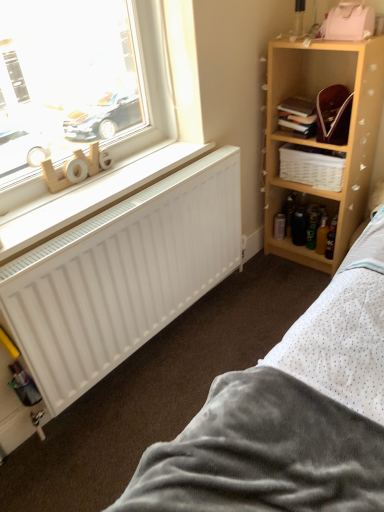
Question: Considering the relative sizes of wooden letters at window and white woven basket at upper right in the image provided, is wooden letters at window wider than white woven basket at upper right?

Choices:
 (A) yes
 (B) no

Answer: (B)

Question: Are wooden letters at window and white woven basket at upper right far apart?

Choices:
 (A) no
 (B) yes

Answer: (A)

Question: Is wooden letters at window facing away from white woven basket at upper right?

Choices:
 (A) no
 (B) yes

Answer: (A)

Question: Is wooden letters at window at the left side of white woven basket at upper right?

Choices:
 (A) no
 (B) yes

Answer: (B)

Question: Considering the relative sizes of wooden letters at window and white woven basket at upper right in the image provided, is wooden letters at window bigger than white woven basket at upper right?

Choices:
 (A) yes
 (B) no

Answer: (B)

Question: Does wooden letters at window have a lesser height compared to white woven basket at upper right?

Choices:
 (A) yes
 (B) no

Answer: (A)

Question: Considering the relative sizes of wooden letters at lower left and hardcover book at upper right in the image provided, is wooden letters at lower left smaller than hardcover book at upper right?

Choices:
 (A) yes
 (B) no

Answer: (B)

Question: From a real-world perspective, is wooden letters at lower left over hardcover book at upper right?

Choices:
 (A) yes
 (B) no

Answer: (B)

Question: Does wooden letters at lower left lie behind hardcover book at upper right?

Choices:
 (A) no
 (B) yes

Answer: (A)

Question: Considering the relative sizes of wooden letters at lower left and hardcover book at upper right in the image provided, is wooden letters at lower left shorter than hardcover book at upper right?

Choices:
 (A) yes
 (B) no

Answer: (A)

Question: Are wooden letters at lower left and hardcover book at upper right far apart?

Choices:
 (A) yes
 (B) no

Answer: (B)

Question: Is wooden letters at lower left facing towards hardcover book at upper right?

Choices:
 (A) no
 (B) yes

Answer: (A)

Question: From the image's perspective, is gray soft fabric bed at lower right beneath wooden shelf at upper right?

Choices:
 (A) yes
 (B) no

Answer: (A)